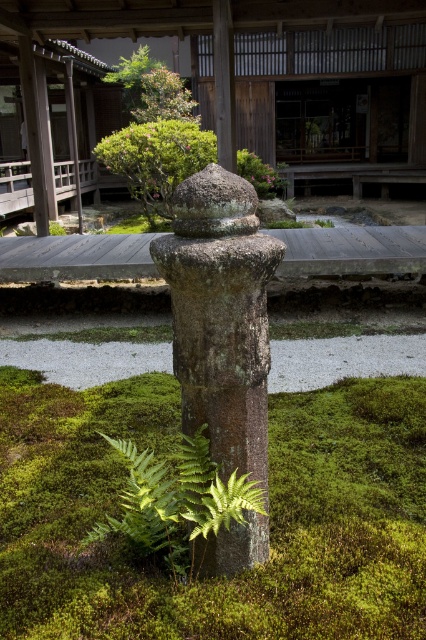
Question: Can you confirm if rusty stone post at center is positioned below green textured bush at center?

Choices:
 (A) yes
 (B) no

Answer: (A)

Question: Which of the following is the closest to the observer?

Choices:
 (A) rusty stone post at center
 (B) green mossy grass at center
 (C) green textured bush at center
 (D) green leafy fern at center

Answer: (D)

Question: Considering the real-world distances, which object is farthest from the green leafy shrub at upper center?

Choices:
 (A) rusty stone post at center
 (B) green textured bush at center

Answer: (A)

Question: Which object is closer to the camera taking this photo?

Choices:
 (A) green leafy fern at center
 (B) rusty stone post at center
 (C) green leafy shrub at upper center
 (D) green textured bush at center

Answer: (A)

Question: Does rusty stone post at center appear on the right side of green leafy fern at center?

Choices:
 (A) yes
 (B) no

Answer: (A)

Question: Is green mossy grass at center to the right of green leafy shrub at upper center from the viewer's perspective?

Choices:
 (A) no
 (B) yes

Answer: (B)